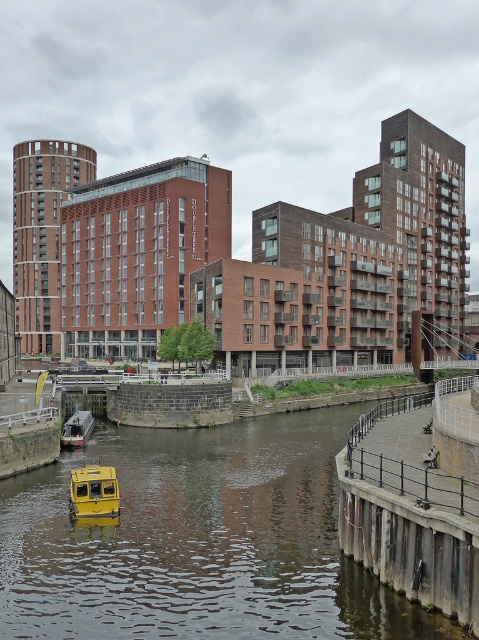
Question: Which object appears closest to the camera in this image?

Choices:
 (A) concrete dock at lower right
 (B) yellow rubber boat at center
 (C) yellow matte boat at lower center
 (D) metallic gray boat at lower left

Answer: (A)

Question: Is concrete dock at lower right above metallic gray boat at lower left?

Choices:
 (A) no
 (B) yes

Answer: (B)

Question: Is yellow matte boat at lower center smaller than metallic gray boat at lower left?

Choices:
 (A) yes
 (B) no

Answer: (B)

Question: Which point appears closest to the camera in this image?

Choices:
 (A) (441, 604)
 (B) (236, 554)

Answer: (A)

Question: Among these objects, which one is nearest to the camera?

Choices:
 (A) yellow matte boat at lower center
 (B) yellow rubber boat at center
 (C) metallic gray boat at lower left
 (D) concrete dock at lower right

Answer: (D)

Question: Is yellow matte boat at lower center further to camera compared to metallic gray boat at lower left?

Choices:
 (A) no
 (B) yes

Answer: (A)